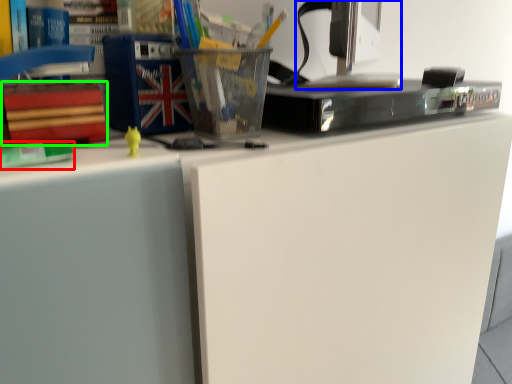
Question: Considering the real-world distances, which object is closest to book (highlighted by a red box)? desktop computer (highlighted by a blue box) or paperback book (highlighted by a green box).

Choices:
 (A) desktop computer
 (B) paperback book

Answer: (B)